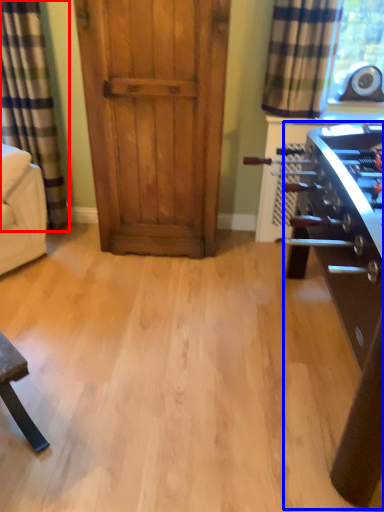
Question: Among these objects, which one is farthest to the camera, curtain (highlighted by a red box) or table (highlighted by a blue box)?

Choices:
 (A) curtain
 (B) table

Answer: (A)